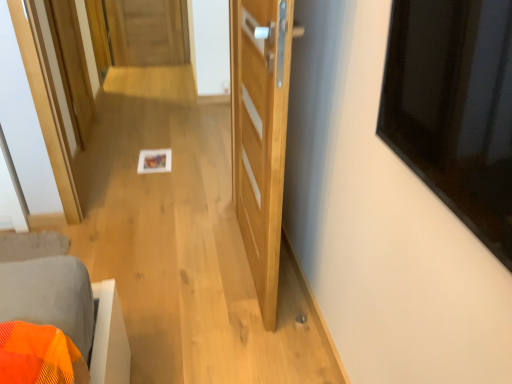
Locate an element on the screen. This screenshot has height=384, width=512. free space in front of natural wood door at center is located at coordinates (228, 325).